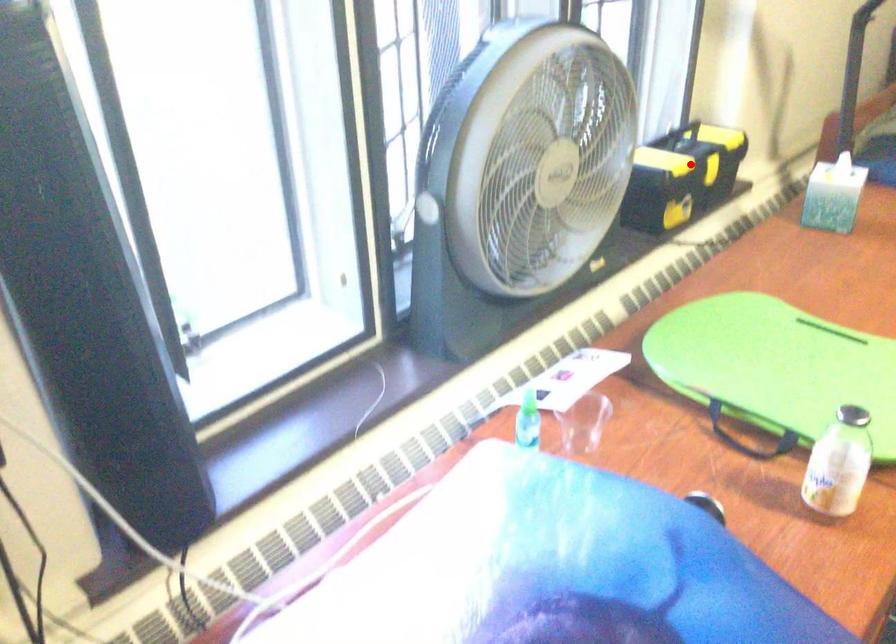
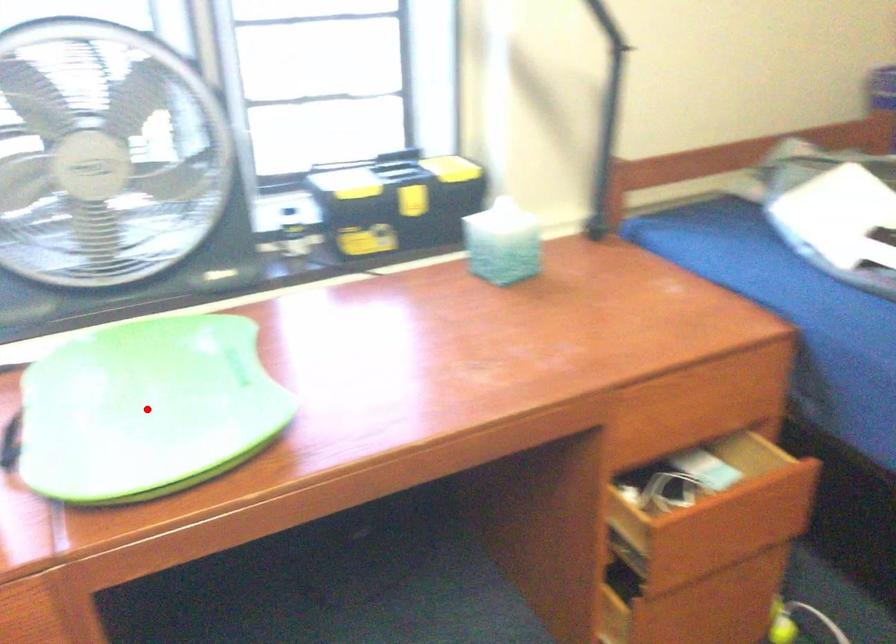
I am providing you with two images of the same scene from different viewpoints. A red point is marked on the first image and another point is marked on the second image. Are the points marked in image1 and image2 representing the same 3D position?

No